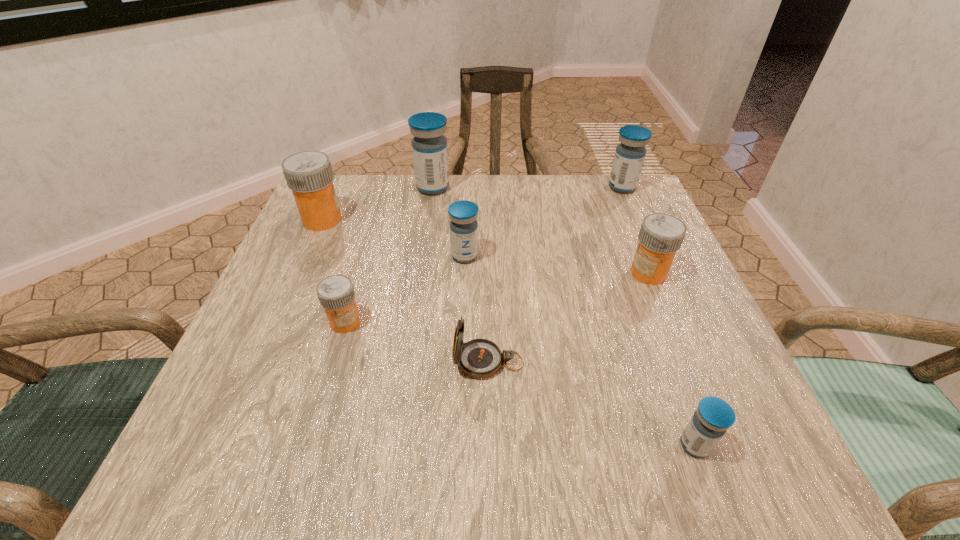
Locate an element on the screen. Image resolution: width=960 pixels, height=540 pixels. vacant space located on the left of the third blue medicine from right to left is located at coordinates (313, 256).

Identify the location of vacant space located 0.360m on the face of the compass. (236, 362).

Where is `vacant space located 0.360m on the face of the compass`? This screenshot has width=960, height=540. vacant space located 0.360m on the face of the compass is located at coordinates (236, 362).

Identify the location of free spot located 0.240m on the face of the compass. This screenshot has height=540, width=960. (308, 362).

Identify the location of vacant space located 0.160m on the label side of the second nearest medicine. (317, 418).

Locate an element on the screen. The height and width of the screenshot is (540, 960). blank space located on the left of the nearest object is located at coordinates (454, 445).

You are a GUI agent. You are given a task and a screenshot of the screen. Output one action in this format:
    pyautogui.click(x=<x>, y=<y>)
    Task: Click on the object that is at the near edge
    Image resolution: width=960 pixels, height=540 pixels.
    Given the screenshot: What is the action you would take?
    pyautogui.click(x=709, y=423)

Where is `object that is at the far left corner`? The height and width of the screenshot is (540, 960). object that is at the far left corner is located at coordinates (309, 174).

At what (x,y) coordinates should I click in order to perform the action: click on object at the far right corner. Please return your answer as a coordinate pair (x, y). The image size is (960, 540). Looking at the image, I should click on (629, 157).

Identify the location of object that is at the near right corner. (709, 423).